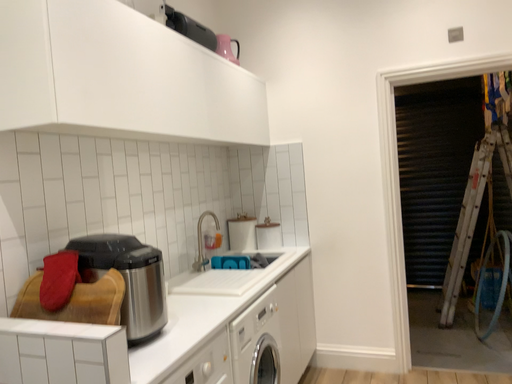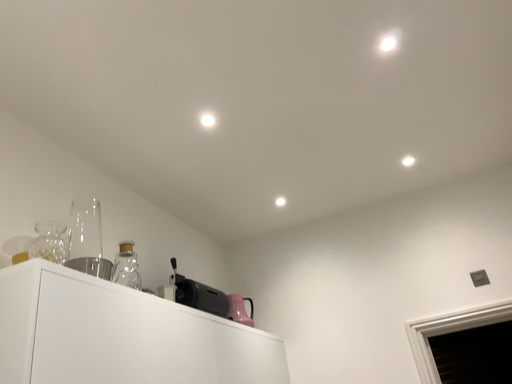
Question: Which way did the camera rotate in the video?

Choices:
 (A) rotated upward
 (B) rotated downward

Answer: (A)